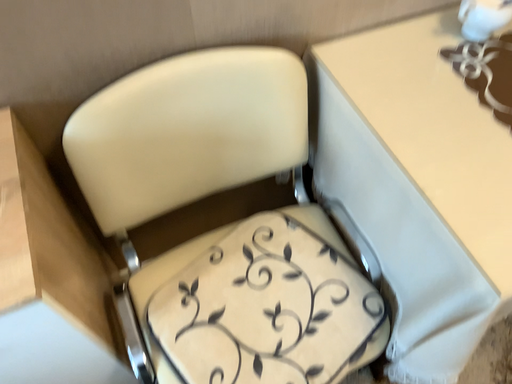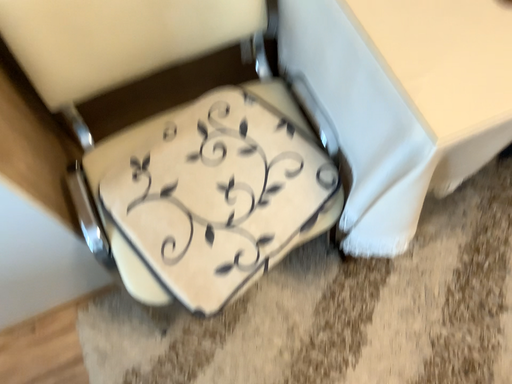
Question: How did the camera likely rotate when shooting the video?

Choices:
 (A) rotated downward
 (B) rotated upward

Answer: (A)